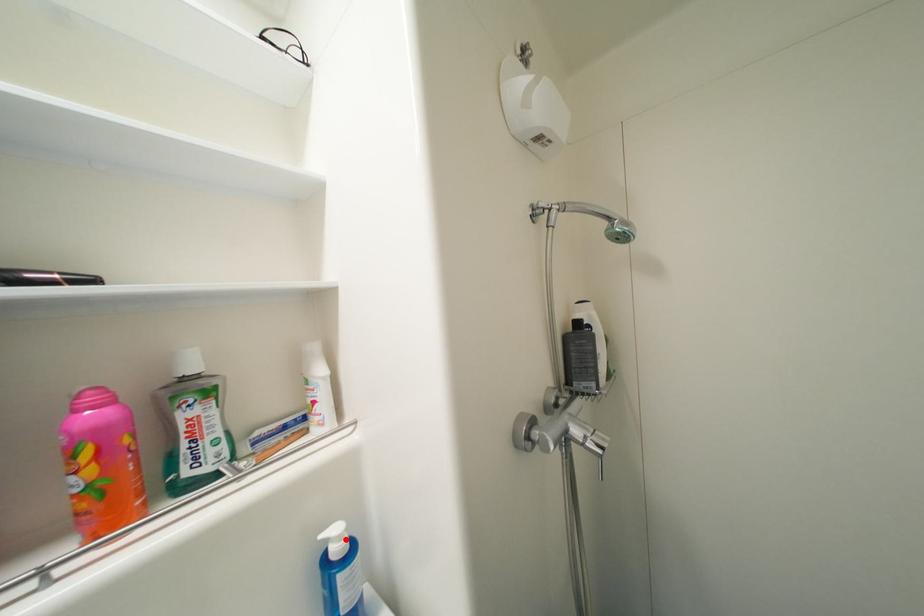
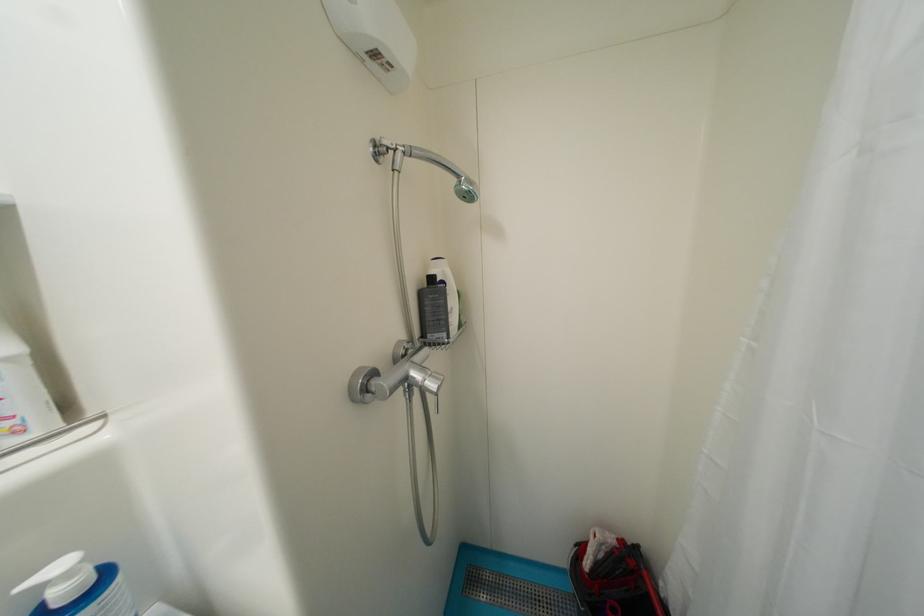
Locate, in the second image, the point that corresponds to the highlighted location in the first image.

(75, 576)